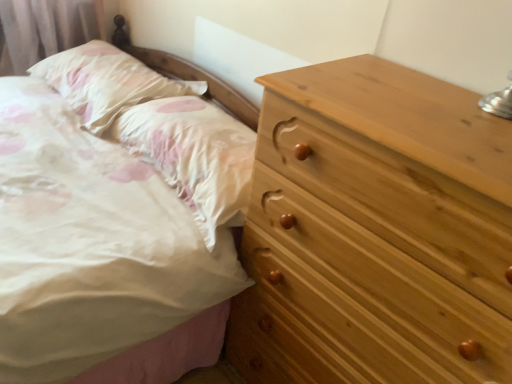
In order to click on vacant space situated above natural wood chest of drawers at right (from a real-world perspective) in this screenshot , I will do `click(432, 104)`.